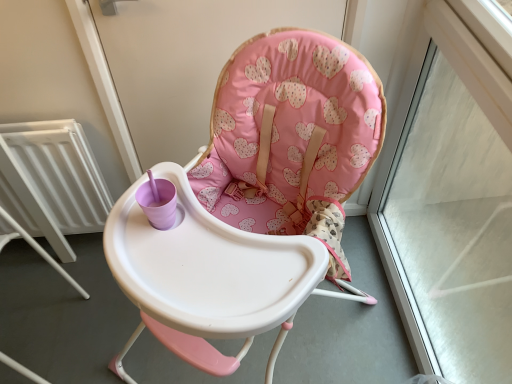
Question: Is white metallic radiator at left at the right side of pink fabric highchair at center?

Choices:
 (A) no
 (B) yes

Answer: (A)

Question: Can you confirm if white metallic radiator at left is thinner than pink fabric highchair at center?

Choices:
 (A) yes
 (B) no

Answer: (A)

Question: From a real-world perspective, does white metallic radiator at left sit lower than pink fabric highchair at center?

Choices:
 (A) no
 (B) yes

Answer: (B)

Question: From the image's perspective, is white metallic radiator at left under pink fabric highchair at center?

Choices:
 (A) yes
 (B) no

Answer: (B)

Question: Does white metallic radiator at left have a larger size compared to pink fabric highchair at center?

Choices:
 (A) yes
 (B) no

Answer: (B)

Question: Can you confirm if white metallic radiator at left is wider than pink fabric highchair at center?

Choices:
 (A) no
 (B) yes

Answer: (A)

Question: Does transparent glass window frame at upper right come in front of white metallic radiator at left?

Choices:
 (A) no
 (B) yes

Answer: (B)

Question: Can you confirm if transparent glass window frame at upper right is smaller than white metallic radiator at left?

Choices:
 (A) yes
 (B) no

Answer: (B)

Question: Does transparent glass window frame at upper right have a greater height compared to white metallic radiator at left?

Choices:
 (A) yes
 (B) no

Answer: (A)

Question: Does transparent glass window frame at upper right appear on the left side of white metallic radiator at left?

Choices:
 (A) no
 (B) yes

Answer: (A)

Question: Is white metallic radiator at left at the back of transparent glass window frame at upper right?

Choices:
 (A) yes
 (B) no

Answer: (B)

Question: Does transparent glass window frame at upper right have a lesser width compared to white metallic radiator at left?

Choices:
 (A) yes
 (B) no

Answer: (B)

Question: Considering the relative sizes of transparent glass window frame at upper right and pink fabric screen door at upper center in the image provided, is transparent glass window frame at upper right smaller than pink fabric screen door at upper center?

Choices:
 (A) yes
 (B) no

Answer: (B)